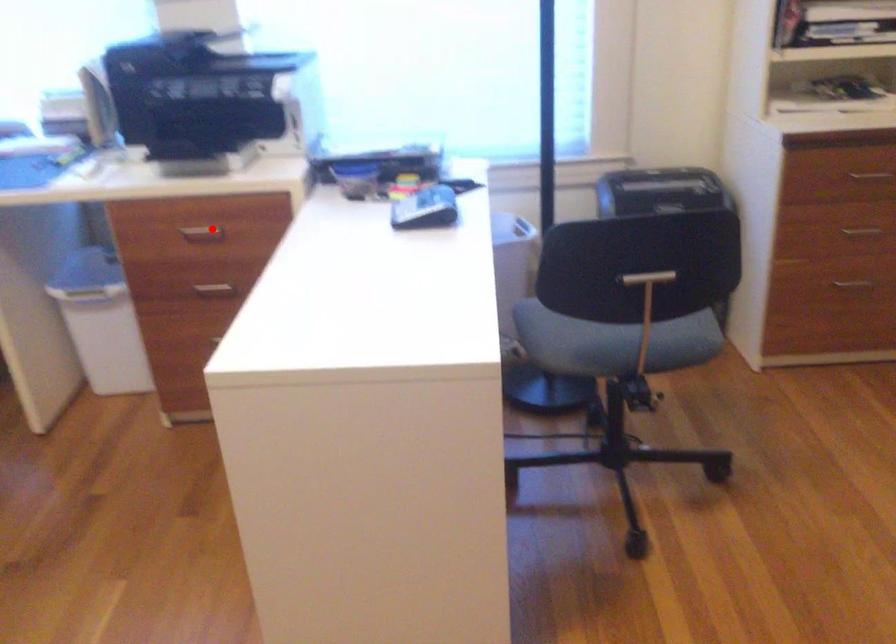
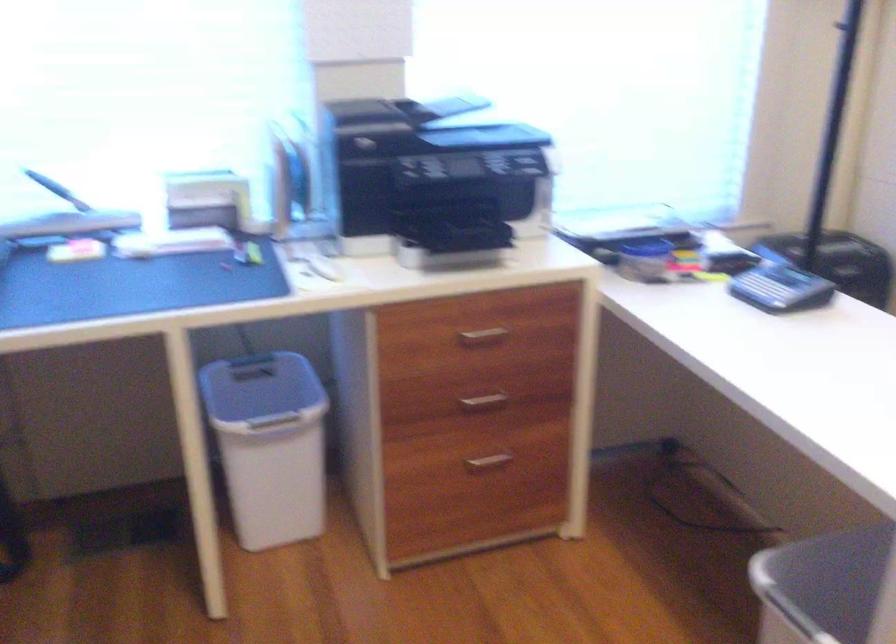
In the second image, find the point that corresponds to the highlighted location in the first image.

(483, 334)